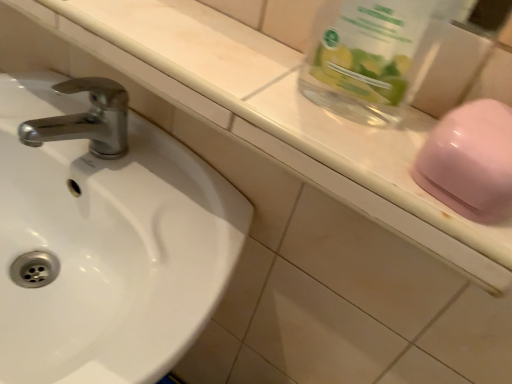
Question: From a real-world perspective, is transparent glass jar at upper right positioned under white glossy sink at left based on gravity?

Choices:
 (A) no
 (B) yes

Answer: (A)

Question: Is white glossy sink at left at the back of transparent glass jar at upper right?

Choices:
 (A) no
 (B) yes

Answer: (A)

Question: Considering the relative positions of transparent glass jar at upper right and white glossy sink at left in the image provided, is transparent glass jar at upper right to the left of white glossy sink at left from the viewer's perspective?

Choices:
 (A) yes
 (B) no

Answer: (B)

Question: Is white glossy sink at left located within transparent glass jar at upper right?

Choices:
 (A) no
 (B) yes

Answer: (A)

Question: From the image's perspective, would you say transparent glass jar at upper right is shown under white glossy sink at left?

Choices:
 (A) yes
 (B) no

Answer: (B)

Question: Would you say transparent glass jar at upper right is inside or outside white glossy sink at left?

Choices:
 (A) outside
 (B) inside

Answer: (A)

Question: Considering the positions of transparent glass jar at upper right and white glossy sink at left in the image, is transparent glass jar at upper right taller or shorter than white glossy sink at left?

Choices:
 (A) short
 (B) tall

Answer: (A)

Question: From a real-world perspective, is transparent glass jar at upper right above or below white glossy sink at left?

Choices:
 (A) above
 (B) below

Answer: (A)

Question: Based on their positions, is transparent glass jar at upper right located to the left or right of white glossy sink at left?

Choices:
 (A) right
 (B) left

Answer: (A)

Question: Looking at their shapes, would you say glossy plastic soap at right is wider or thinner than transparent glass jar at upper right?

Choices:
 (A) thin
 (B) wide

Answer: (B)

Question: In the image, is glossy plastic soap at right positioned in front of or behind transparent glass jar at upper right?

Choices:
 (A) front
 (B) behind

Answer: (B)

Question: Considering the positions of point (426, 188) and point (373, 76), is point (426, 188) closer or farther from the camera than point (373, 76)?

Choices:
 (A) closer
 (B) farther

Answer: (A)

Question: Is glossy plastic soap at right taller or shorter than transparent glass jar at upper right?

Choices:
 (A) short
 (B) tall

Answer: (A)

Question: From a real-world perspective, is glossy plastic soap at right positioned above or below white glossy sink at left?

Choices:
 (A) above
 (B) below

Answer: (A)

Question: Looking at the image, does glossy plastic soap at right seem bigger or smaller compared to white glossy sink at left?

Choices:
 (A) small
 (B) big

Answer: (A)